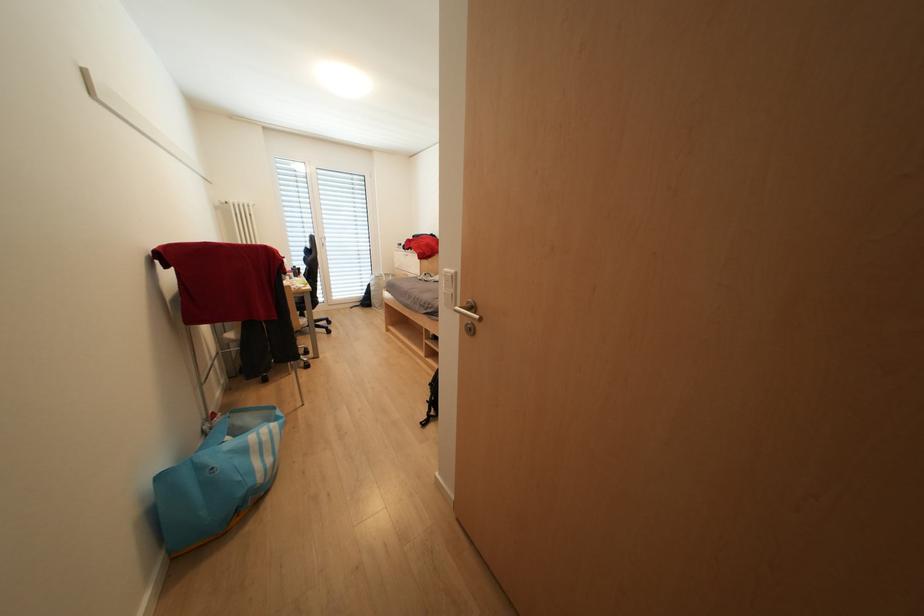
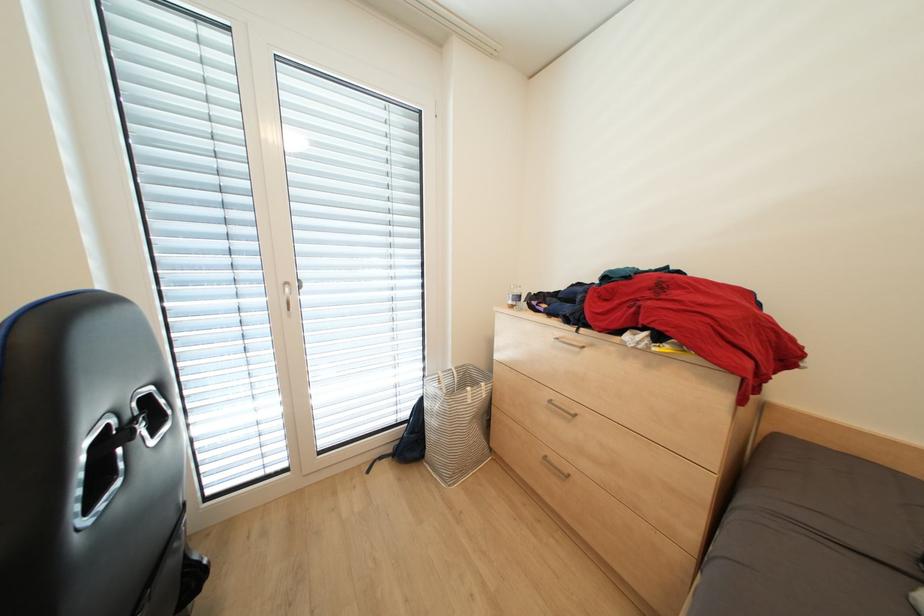
Which direction would the cameraman need to move to produce the second image?

The cameraman moved toward left, forward.